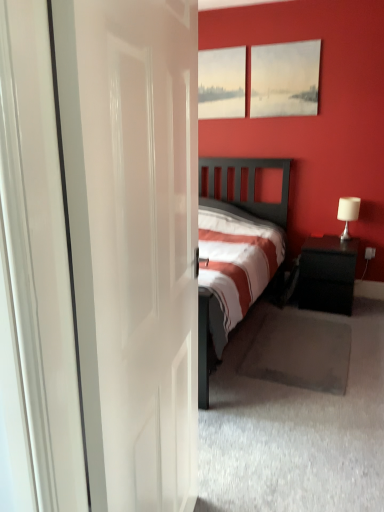
Question: Could you tell me if white fabric lampshade at right is facing matte white painting at upper center?

Choices:
 (A) no
 (B) yes

Answer: (A)

Question: Is white fabric lampshade at right oriented away from matte white painting at upper center?

Choices:
 (A) yes
 (B) no

Answer: (B)

Question: Is white fabric lampshade at right closer to camera compared to matte white painting at upper center?

Choices:
 (A) yes
 (B) no

Answer: (A)

Question: Is white fabric lampshade at right not inside matte white painting at upper center?

Choices:
 (A) yes
 (B) no

Answer: (A)

Question: Can you confirm if white fabric lampshade at right is smaller than matte white painting at upper center?

Choices:
 (A) yes
 (B) no

Answer: (A)

Question: From the image's perspective, does white fabric lampshade at right appear lower than matte white painting at upper center?

Choices:
 (A) no
 (B) yes

Answer: (B)

Question: Could you tell me if black glossy nightstand at right is turned towards white glossy door at center?

Choices:
 (A) no
 (B) yes

Answer: (B)

Question: From a real-world perspective, is black glossy nightstand at right located higher than white glossy door at center?

Choices:
 (A) no
 (B) yes

Answer: (A)

Question: Is black glossy nightstand at right outside white glossy door at center?

Choices:
 (A) yes
 (B) no

Answer: (A)

Question: Does black glossy nightstand at right appear on the left side of white glossy door at center?

Choices:
 (A) no
 (B) yes

Answer: (A)

Question: Considering the relative sizes of black glossy nightstand at right and white glossy door at center in the image provided, is black glossy nightstand at right wider than white glossy door at center?

Choices:
 (A) yes
 (B) no

Answer: (A)

Question: Does black glossy nightstand at right have a lesser height compared to white glossy door at center?

Choices:
 (A) yes
 (B) no

Answer: (A)

Question: Does matte white painting at upper center have a larger size compared to black glossy nightstand at right?

Choices:
 (A) yes
 (B) no

Answer: (B)